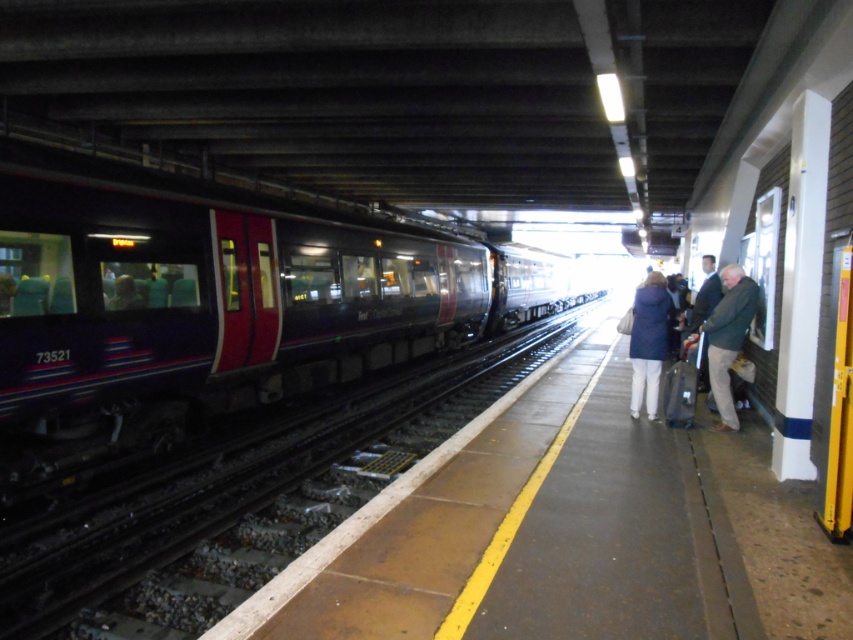
Question: Is dark green jacket at right to the right of matte blue coat at right from the viewer's perspective?

Choices:
 (A) no
 (B) yes

Answer: (B)

Question: Which point is farther to the camera?

Choices:
 (A) dark green jacket at right
 (B) matte blue coat at right
 (C) dark blue jacket at right

Answer: (B)

Question: Which point is farther to the camera?

Choices:
 (A) (656, 356)
 (B) (741, 296)
 (C) (723, 268)
 (D) (264, 470)

Answer: (C)

Question: Which object is closer to the camera taking this photo?

Choices:
 (A) dark blue jacket at right
 (B) metallic train track at center

Answer: (B)

Question: Can you confirm if metallic train track at center is thinner than dark blue jacket at right?

Choices:
 (A) no
 (B) yes

Answer: (A)

Question: Is metallic train track at center above dark green jacket at right?

Choices:
 (A) yes
 (B) no

Answer: (B)